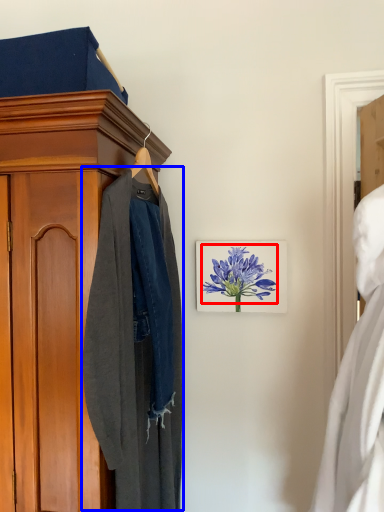
Question: Among these objects, which one is farthest to the camera, flower (highlighted by a red box) or clothing (highlighted by a blue box)?

Choices:
 (A) flower
 (B) clothing

Answer: (A)